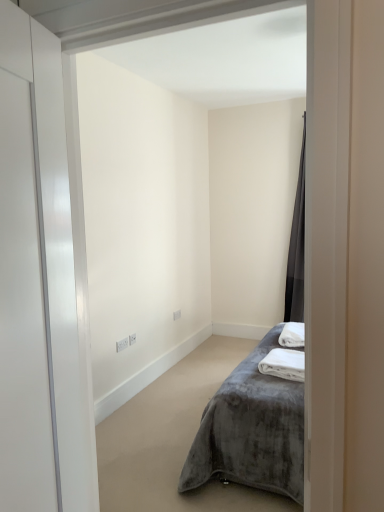
Question: Considering the positions of white soft towel at lower right, positioned as the second bath towel in back-to-front order, and velvet grey bed at center in the image, is white soft towel at lower right, positioned as the second bath towel in back-to-front order, wider or thinner than velvet grey bed at center?

Choices:
 (A) wide
 (B) thin

Answer: (B)

Question: Considering their positions, is white soft towel at lower right, positioned as the second bath towel in back-to-front order, located in front of or behind velvet grey bed at center?

Choices:
 (A) front
 (B) behind

Answer: (B)

Question: Estimate the real-world distances between objects in this image. Which object is closer to the velvet grey bed at center?

Choices:
 (A) white plush bath towel at lower right, the first bath towel positioned from the back
 (B) dark gray velvet curtain at right
 (C) white soft towel at lower right, positioned as the second bath towel in back-to-front order
 (D) white glossy door at left

Answer: (C)

Question: Which is nearer to the white glossy door at left?

Choices:
 (A) white plush bath towel at lower right, the first bath towel positioned from the back
 (B) velvet grey bed at center
 (C) dark gray velvet curtain at right
 (D) white soft towel at lower right, the 1th bath towel from the front

Answer: (B)